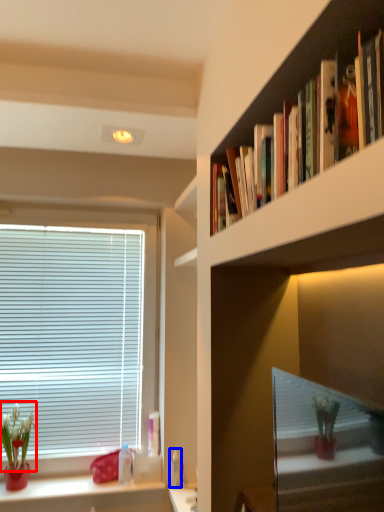
Question: Which object appears farthest to the camera in this image, floral arrangement (highlighted by a red box) or toiletry (highlighted by a blue box)?

Choices:
 (A) floral arrangement
 (B) toiletry

Answer: (B)